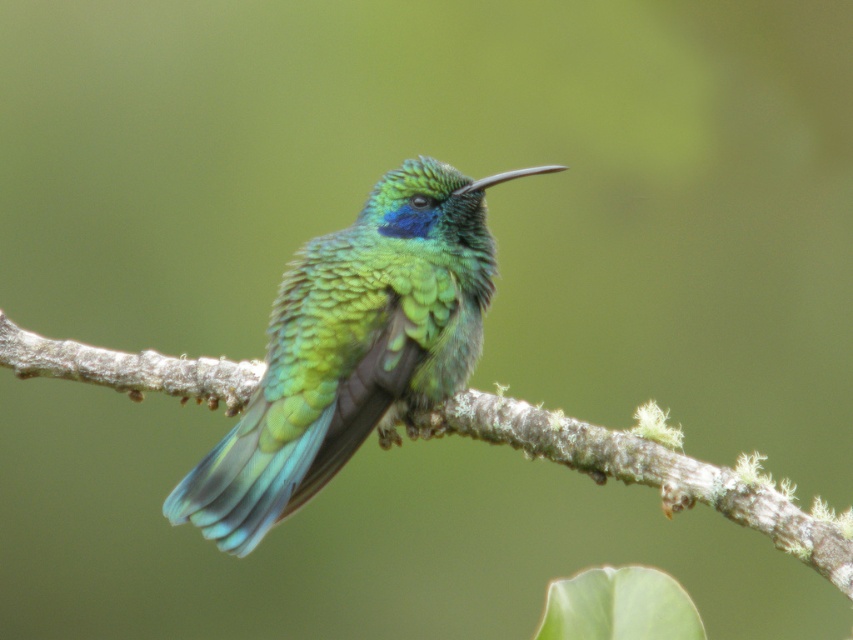
Which is more to the right, shiny green hummingbird at center or brown rough tree branch at center?

brown rough tree branch at center is more to the right.

Can you confirm if shiny green hummingbird at center is bigger than brown rough tree branch at center?

Yes.

You are a GUI agent. You are given a task and a screenshot of the screen. Output one action in this format:
    pyautogui.click(x=<x>, y=<y>)
    Task: Click on the shiny green hummingbird at center
    
    Given the screenshot: What is the action you would take?
    352,348